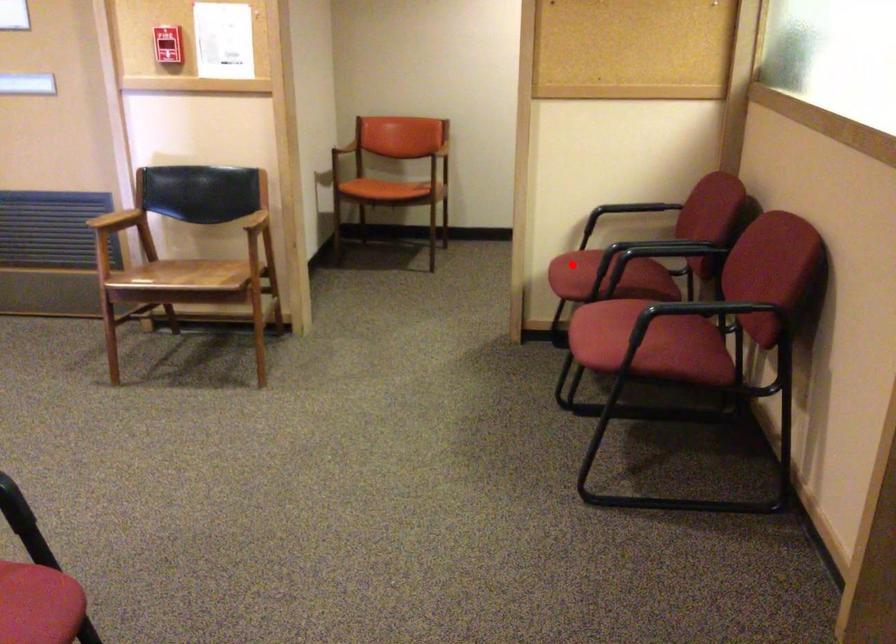
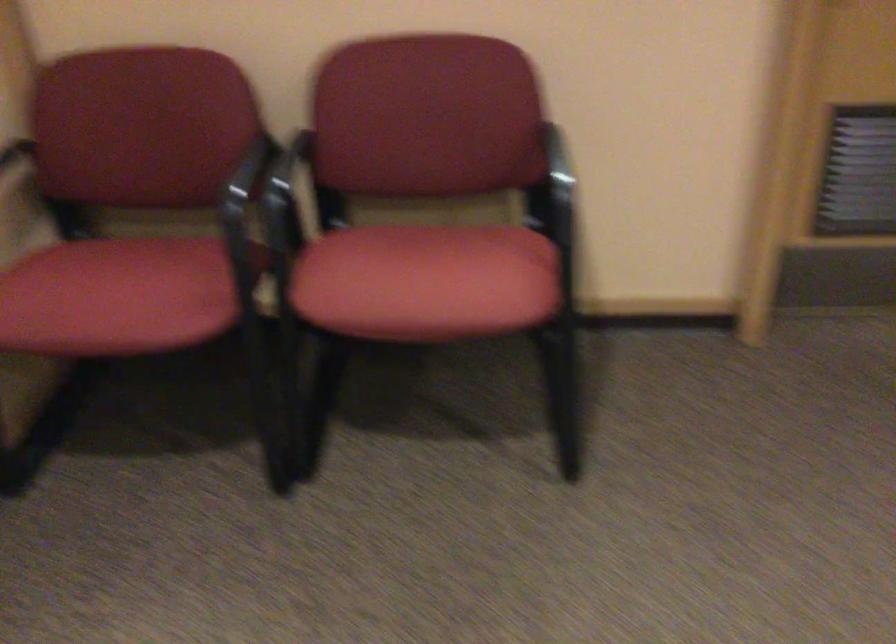
Question: I am providing you with two images of the same scene from different viewpoints. In image1, a red point is highlighted. Considering the same 3D point in image2, which of the following is correct?

Choices:
 (A) It is closer
 (B) It is farther

Answer: (A)